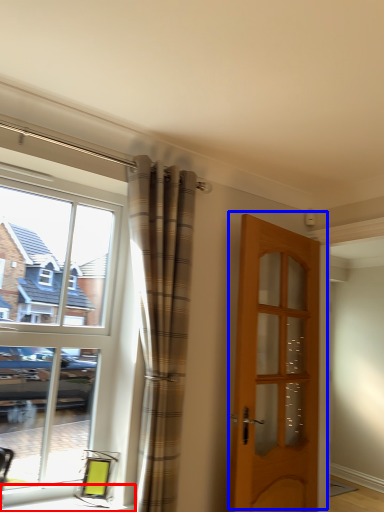
Question: Which object appears farthest to the camera in this image, window sill (highlighted by a red box) or door (highlighted by a blue box)?

Choices:
 (A) window sill
 (B) door

Answer: (B)